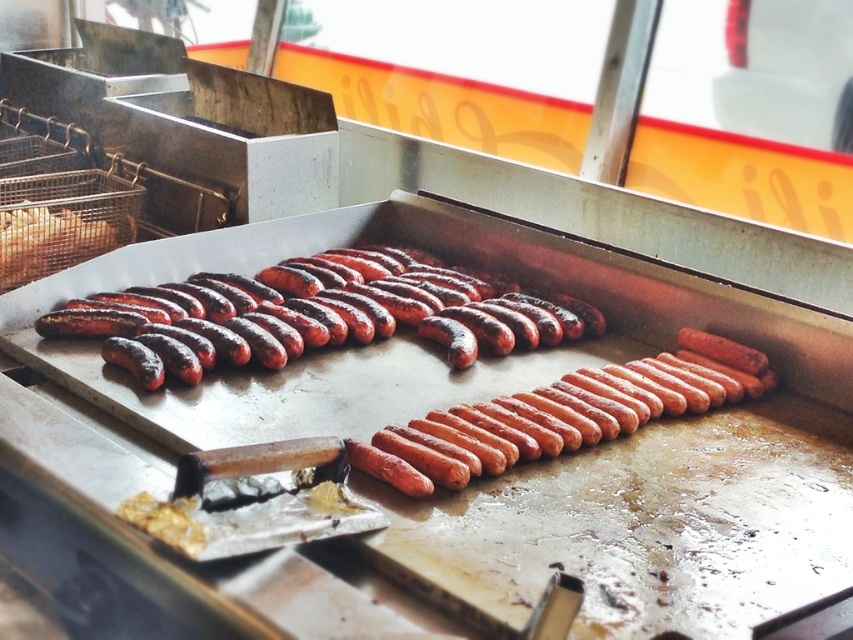
Consider the image. You are a cook standing at the grill and want to place a new uncooked sausage exactly where the charred glossy sausages at center are located. Can you do that?

The charred glossy sausages at center are located at point (314, 314), so yes, you can place the new uncooked sausage at that exact location.

You are a food inspector checking the grill. You need to determine which of the items, the charred glossy sausages at center or the shiny metallic hot dog at left, is more suitable for serving to customers. Based on their appearance, which one is more likely to be fully cooked?

The charred glossy sausages at center are more likely to be fully cooked because they show signs of charring, which indicates they have been cooked longer and reached a higher temperature than the shiny metallic hot dog at left.